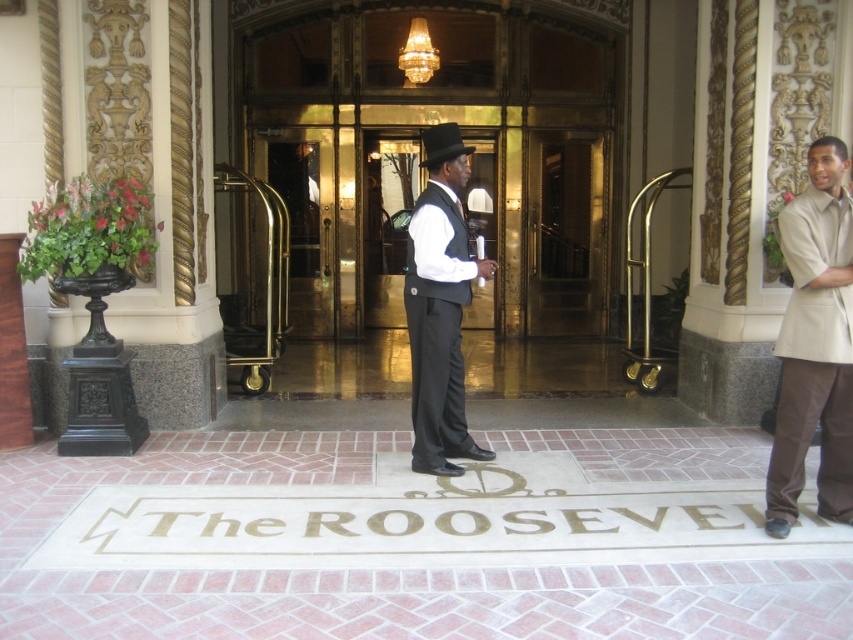
Does beige fabric coat at right appear under black felt fedora at center?

Yes, beige fabric coat at right is below black felt fedora at center.

Between beige fabric coat at right and black felt fedora at center, which one has more height?

beige fabric coat at right

The height and width of the screenshot is (640, 853). What are the coordinates of `beige fabric coat at right` in the screenshot? It's located at (814, 344).

Between point (601, 234) and point (804, 272), which one is positioned in front?

Point (804, 272) is more forward.

Which is above, shiny gold door at center or beige fabric coat at right?

shiny gold door at center

Which is behind, point (271, 140) or point (845, 435)?

The point (271, 140) is more distant.

Locate an element on the screen. Image resolution: width=853 pixels, height=640 pixels. shiny gold door at center is located at coordinates (424, 182).

Based on the photo, is shiny gold door at center thinner than matte black suit at center?

Yes.

The height and width of the screenshot is (640, 853). What are the coordinates of `shiny gold door at center` in the screenshot? It's located at (424, 182).